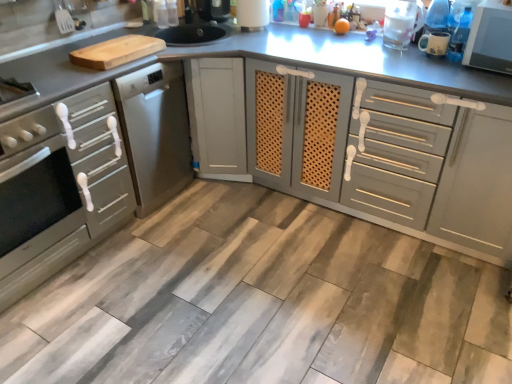
The width and height of the screenshot is (512, 384). What are the coordinates of `vacant space situated on the left part of white glossy microwave at upper right` in the screenshot? It's located at (423, 69).